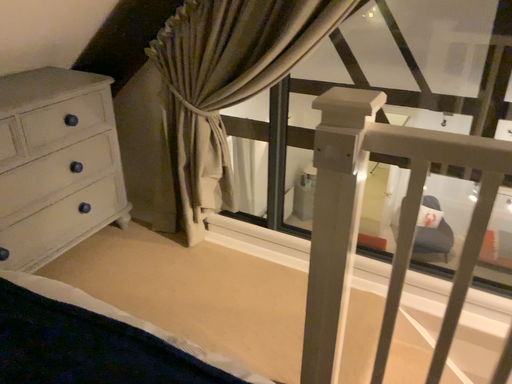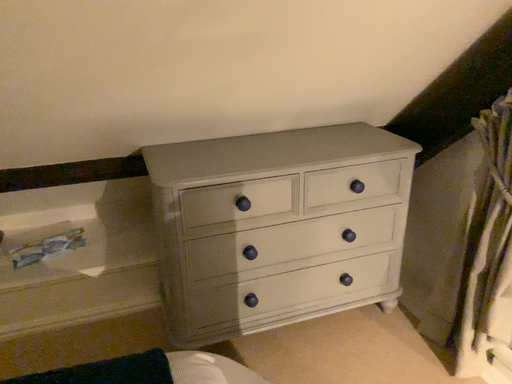
Question: Which way did the camera rotate in the video?

Choices:
 (A) rotated upward
 (B) rotated downward

Answer: (A)